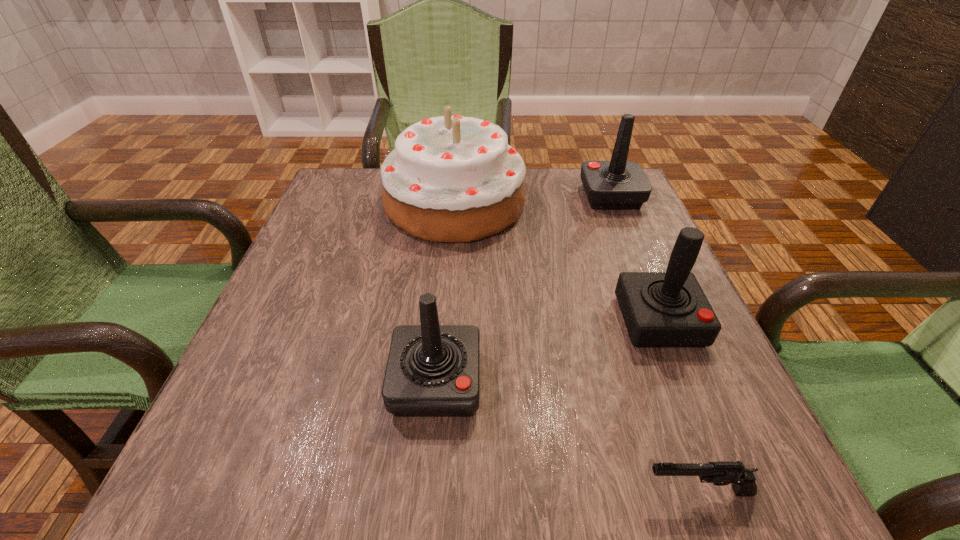
Locate an element on the screen. This screenshot has height=540, width=960. vacant space at the right edge is located at coordinates (652, 232).

Where is `vacant space at the far left corner of the desktop`? This screenshot has height=540, width=960. vacant space at the far left corner of the desktop is located at coordinates pyautogui.click(x=372, y=190).

In the image, there is a desktop. Where is `vacant region at the near left corner`? The image size is (960, 540). vacant region at the near left corner is located at coordinates (209, 444).

I want to click on vacant point at the near right corner, so click(698, 445).

Identify the location of free area in between the leftmost joystick and the farthest joystick. The image size is (960, 540). (523, 289).

Find the location of a particular element. This screenshot has height=540, width=960. free space between the leftmost joystick and the shortest object is located at coordinates (566, 437).

Identify the location of vacant space that is in between the cake and the leftmost joystick. This screenshot has width=960, height=540. (445, 293).

In order to click on vacant region between the cake and the farthest joystick in this screenshot , I will do `click(533, 200)`.

Identify the location of vacant point located between the cake and the leftmost joystick. (445, 293).

Identify which object is the second nearest to the shortest object. Please provide its 2D coordinates. Your answer should be formatted as a tuple, i.e. [(x, y)], where the tuple contains the x and y coordinates of a point satisfying the conditions above.

[(432, 370)]